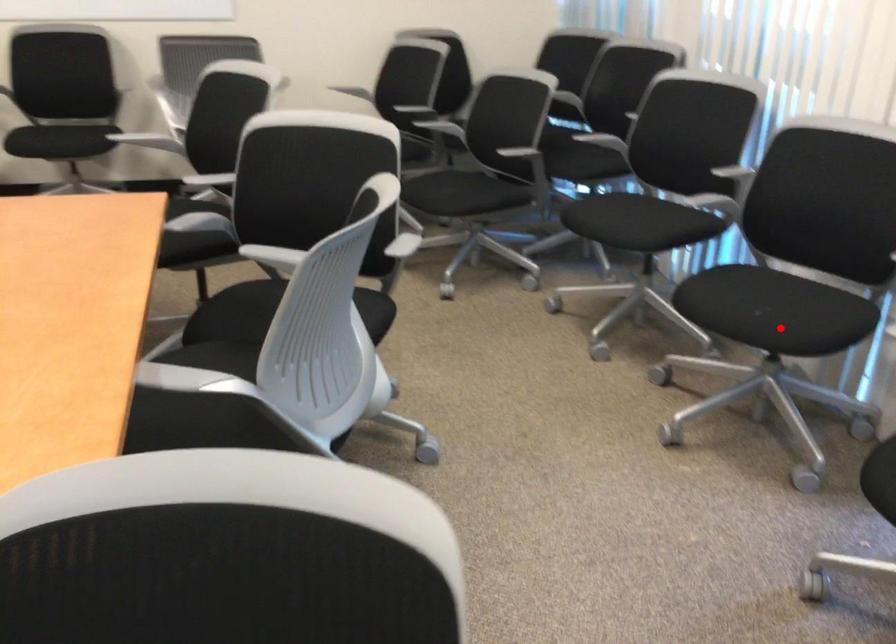
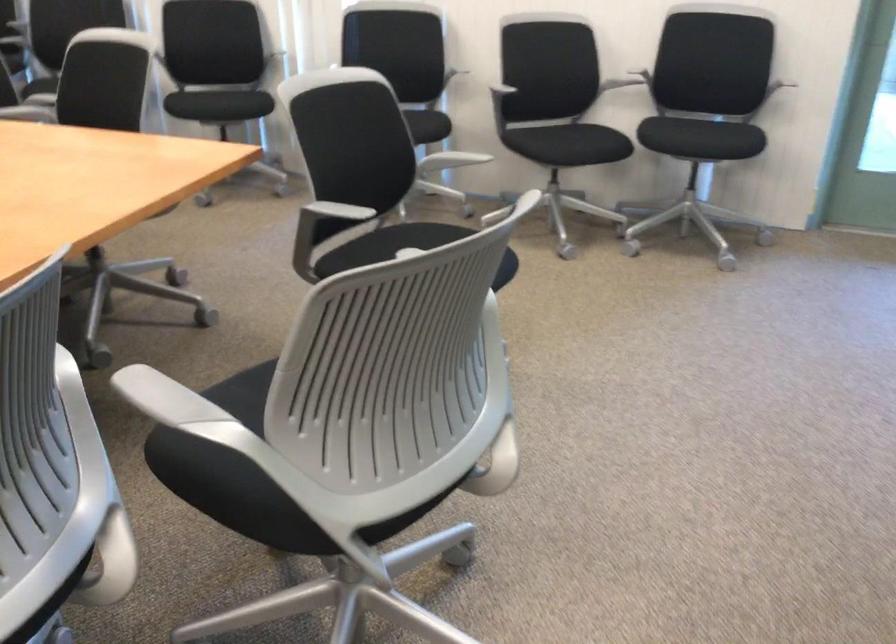
Question: A red point is marked in image1. In image2, is the corresponding 3D point closer to the camera or farther? Reply with the corresponding letter.

Choices:
 (A) The corresponding 3D point is closer.
 (B) The corresponding 3D point is farther.

Answer: (B)